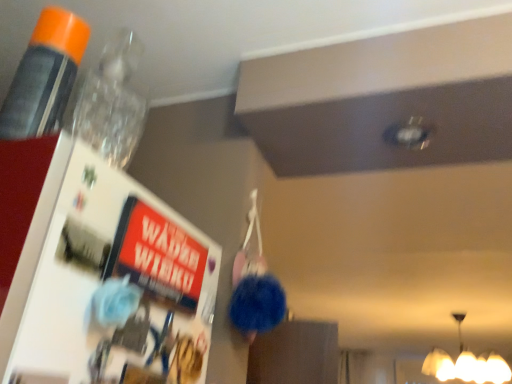
Question: Is matte white lampshade at lower right far away from orange cap plastic bottle at upper left?

Choices:
 (A) no
 (B) yes

Answer: (B)

Question: From a real-world perspective, is matte white lampshade at lower right physically above orange cap plastic bottle at upper left?

Choices:
 (A) no
 (B) yes

Answer: (B)

Question: Considering the relative sizes of matte white lampshade at lower right and orange cap plastic bottle at upper left in the image provided, is matte white lampshade at lower right bigger than orange cap plastic bottle at upper left?

Choices:
 (A) yes
 (B) no

Answer: (A)

Question: From a real-world perspective, does matte white lampshade at lower right sit lower than orange cap plastic bottle at upper left?

Choices:
 (A) no
 (B) yes

Answer: (A)

Question: Is orange cap plastic bottle at upper left a part of matte white lampshade at lower right?

Choices:
 (A) yes
 (B) no

Answer: (B)

Question: Is matte white lampshade at lower right to the right of orange cap plastic bottle at upper left from the viewer's perspective?

Choices:
 (A) yes
 (B) no

Answer: (A)

Question: Is orange cap plastic bottle at upper left taller than matte white lampshade at lower right?

Choices:
 (A) no
 (B) yes

Answer: (A)

Question: Is the position of orange cap plastic bottle at upper left more distant than that of matte white lampshade at lower right?

Choices:
 (A) no
 (B) yes

Answer: (A)

Question: Is orange cap plastic bottle at upper left bigger than matte white lampshade at lower right?

Choices:
 (A) no
 (B) yes

Answer: (A)

Question: From the image's perspective, would you say orange cap plastic bottle at upper left is shown under matte white lampshade at lower right?

Choices:
 (A) no
 (B) yes

Answer: (A)

Question: From the image's perspective, is orange cap plastic bottle at upper left on top of matte white lampshade at lower right?

Choices:
 (A) no
 (B) yes

Answer: (B)

Question: Is orange cap plastic bottle at upper left oriented away from matte white lampshade at lower right?

Choices:
 (A) yes
 (B) no

Answer: (B)

Question: Considering the positions of matte white lampshade at lower right and orange cap plastic bottle at upper left in the image, is matte white lampshade at lower right taller or shorter than orange cap plastic bottle at upper left?

Choices:
 (A) short
 (B) tall

Answer: (B)